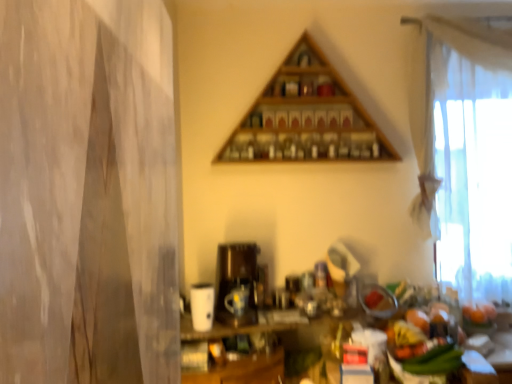
What do you see at coordinates (237, 283) in the screenshot? Image resolution: width=512 pixels, height=384 pixels. I see `matte black coffee machine at center` at bounding box center [237, 283].

You are a GUI agent. You are given a task and a screenshot of the screen. Output one action in this format:
    pyautogui.click(x=<x>, y=<y>)
    Task: Click on the white sheer curtain at right
    The height and width of the screenshot is (384, 512).
    Given the screenshot: What is the action you would take?
    pos(472,167)

This screenshot has width=512, height=384. What do you see at coordinates (306, 117) in the screenshot?
I see `wooden triangle at upper center` at bounding box center [306, 117].

Find the location of a particular element. The image size is (512, 384). wooden triangle at upper center is located at coordinates (306, 117).

You are a GUI agent. You are given a task and a screenshot of the screen. Output one action in this format:
    pyautogui.click(x=<x>, y=<y>)
    Task: Click on the matte black coffee machine at center
    
    Given the screenshot: What is the action you would take?
    pyautogui.click(x=237, y=283)

Does matte black coffee machine at center contain white sheer curtain at right?

No, white sheer curtain at right is not inside matte black coffee machine at center.

Can you confirm if matte black coffee machine at center is bigger than white sheer curtain at right?

Correct, matte black coffee machine at center is larger in size than white sheer curtain at right.

How different are the orientations of matte black coffee machine at center and white sheer curtain at right in degrees?

13.6 degrees separate the facing orientations of matte black coffee machine at center and white sheer curtain at right.

Would you say white sheer curtain at right is inside or outside wooden triangle at upper center?

white sheer curtain at right is not enclosed by wooden triangle at upper center.

How different are the orientations of white sheer curtain at right and wooden triangle at upper center in degrees?

There is a 1.08-degree angle between the facing directions of white sheer curtain at right and wooden triangle at upper center.

Considering the relative sizes of white sheer curtain at right and wooden triangle at upper center in the image provided, is white sheer curtain at right thinner than wooden triangle at upper center?

Indeed, white sheer curtain at right has a lesser width compared to wooden triangle at upper center.

Is white sheer curtain at right turned away from wooden triangle at upper center?

No, wooden triangle at upper center is not at the back of white sheer curtain at right.

What's the angular difference between matte black coffee machine at center and wooden triangle at upper center's facing directions?

There is a 14.7-degree angle between the facing directions of matte black coffee machine at center and wooden triangle at upper center.

Are matte black coffee machine at center and wooden triangle at upper center far apart?

That's not correct — matte black coffee machine at center is a little close to wooden triangle at upper center.

From a real-world perspective, is matte black coffee machine at center positioned under wooden triangle at upper center based on gravity?

Yes, from a real-world perspective, matte black coffee machine at center is under wooden triangle at upper center.

Is wooden triangle at upper center outside of matte black coffee machine at center?

Yes, wooden triangle at upper center is located beyond the bounds of matte black coffee machine at center.

Who is taller, wooden triangle at upper center or matte black coffee machine at center?

With more height is wooden triangle at upper center.

Is wooden triangle at upper center turned away from matte black coffee machine at center?

No, wooden triangle at upper center is not facing the opposite direction of matte black coffee machine at center.

Image resolution: width=512 pixels, height=384 pixels. In order to click on appliance that appears below the wooden triangle at upper center (from the image's perspective) in this screenshot , I will do `click(237, 283)`.

Are white sheer curtain at right and matte black coffee machine at center far apart?

Yes, white sheer curtain at right is far from matte black coffee machine at center.

Is white sheer curtain at right completely or partially outside of matte black coffee machine at center?

Indeed, white sheer curtain at right is completely outside matte black coffee machine at center.

Which is in front, white sheer curtain at right or matte black coffee machine at center?

matte black coffee machine at center is in front.

Based on the photo, how many degrees apart are the facing directions of white sheer curtain at right and matte black coffee machine at center?

The angle between the facing direction of white sheer curtain at right and the facing direction of matte black coffee machine at center is 13.6 degrees.

From the image's perspective, which one is positioned higher, wooden triangle at upper center or white sheer curtain at right?

wooden triangle at upper center is shown above in the image.

Does wooden triangle at upper center turn towards white sheer curtain at right?

No, wooden triangle at upper center is not oriented towards white sheer curtain at right.

Relative to white sheer curtain at right, is wooden triangle at upper center in front or behind?

Visually, wooden triangle at upper center is located in front of white sheer curtain at right.

Can you tell me how much wooden triangle at upper center and white sheer curtain at right differ in facing direction?

The facing directions of wooden triangle at upper center and white sheer curtain at right are 1.08 degrees apart.

This screenshot has width=512, height=384. In order to click on curtain on the right of the matte black coffee machine at center in this screenshot , I will do `click(472, 167)`.

Find the location of a particular element. This screenshot has height=384, width=512. curtain below the wooden triangle at upper center (from the image's perspective) is located at coordinates (472, 167).

Which object lies further to the anchor point white sheer curtain at right, wooden triangle at upper center or matte black coffee machine at center?

Based on the image, matte black coffee machine at center appears to be further to white sheer curtain at right.

Looking at the image, which one is located closer to wooden triangle at upper center, white sheer curtain at right or matte black coffee machine at center?

Among the two, white sheer curtain at right is located nearer to wooden triangle at upper center.

Which object lies nearer to the anchor point white sheer curtain at right, matte black coffee machine at center or wooden triangle at upper center?

Based on the image, wooden triangle at upper center appears to be nearer to white sheer curtain at right.

Estimate the real-world distances between objects in this image. Which object is further from wooden triangle at upper center, matte black coffee machine at center or white sheer curtain at right?

matte black coffee machine at center is positioned further to the anchor wooden triangle at upper center.

Looking at the image, which one is located further to matte black coffee machine at center, wooden triangle at upper center or white sheer curtain at right?

white sheer curtain at right is positioned further to the anchor matte black coffee machine at center.

When comparing their distances from matte black coffee machine at center, does white sheer curtain at right or wooden triangle at upper center seem closer?

The object closer to matte black coffee machine at center is wooden triangle at upper center.

Where is `shelf situated between matte black coffee machine at center and white sheer curtain at right from left to right`? The height and width of the screenshot is (384, 512). shelf situated between matte black coffee machine at center and white sheer curtain at right from left to right is located at coordinates (306, 117).